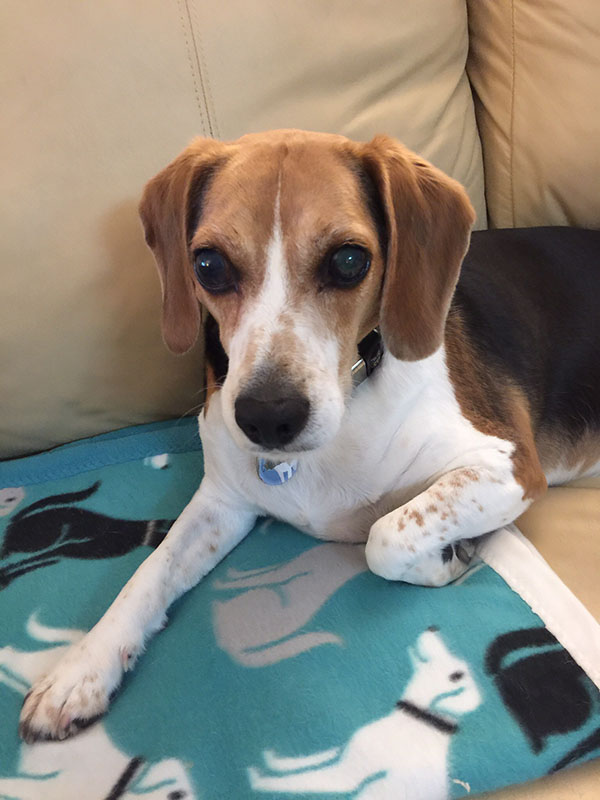
Where is `left pillow`? The width and height of the screenshot is (600, 800). left pillow is located at coordinates (85, 277).